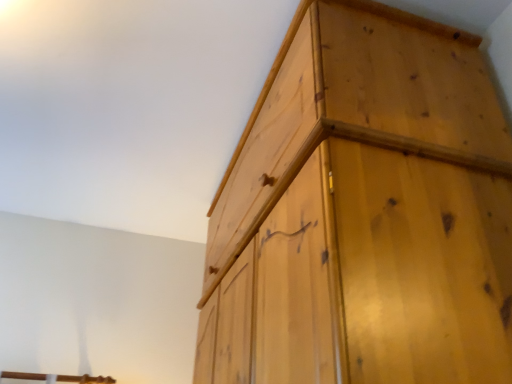
Locate an element on the screen. Image resolution: width=512 pixels, height=384 pixels. natural wood cupboard at upper right is located at coordinates (364, 212).

The width and height of the screenshot is (512, 384). Describe the element at coordinates (364, 212) in the screenshot. I see `natural wood cupboard at upper right` at that location.

Locate an element on the screen. Image resolution: width=512 pixels, height=384 pixels. natural wood cupboard at upper right is located at coordinates (364, 212).